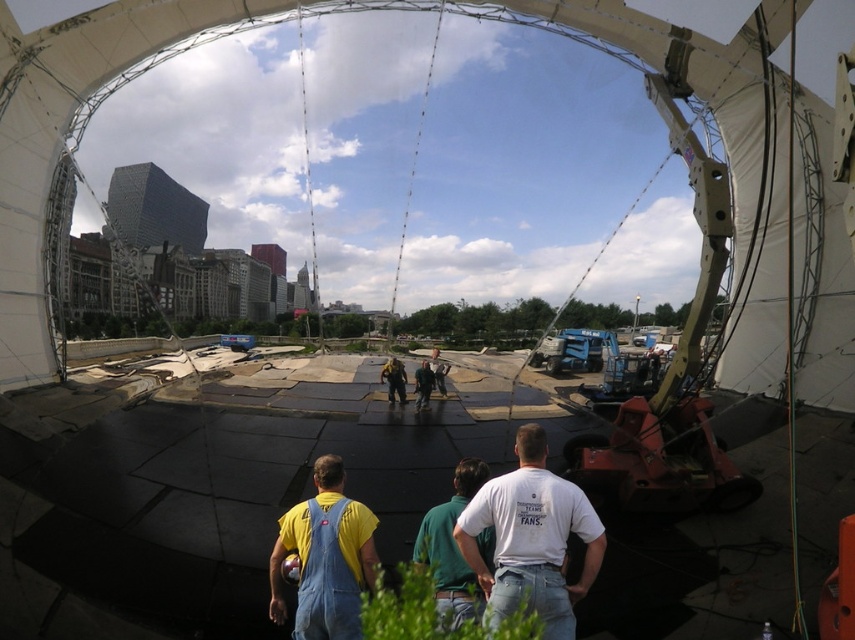
Question: Estimate the real-world distances between objects in this image. Which object is closer to the yellow fabric worker at center?

Choices:
 (A) green cotton shirt at center
 (B) dark green fabric pants at center

Answer: (B)

Question: Can you confirm if green cotton shirt at center is wider than yellow fabric worker at center?

Choices:
 (A) yes
 (B) no

Answer: (A)

Question: Which object is the farthest from the white cotton t-shirt at center?

Choices:
 (A) dark green fabric pants at center
 (B) yellow fabric worker at center
 (C) denim overalls at center

Answer: (B)

Question: Which point is closer to the camera?

Choices:
 (A) denim overalls at center
 (B) dark green fabric pants at center
 (C) green cotton shirt at center

Answer: (A)

Question: Is dark gray concrete at center below dark green fabric pants at center?

Choices:
 (A) yes
 (B) no

Answer: (A)

Question: Is white cotton t-shirt at center below denim overalls at center?

Choices:
 (A) no
 (B) yes

Answer: (A)